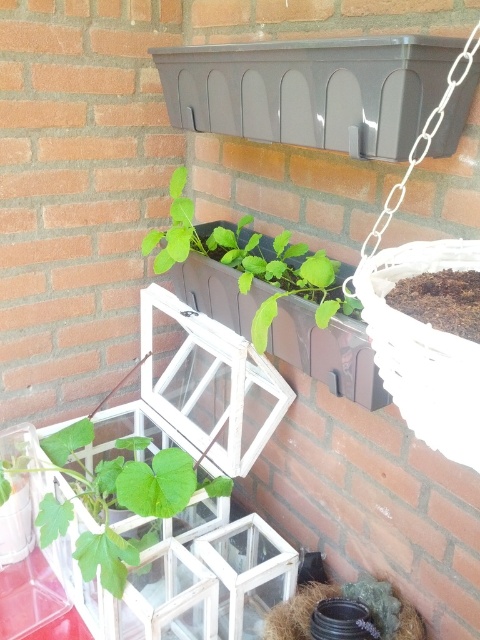
Question: Does green matte leafy plant at center have a lesser width compared to green matte plant at center?

Choices:
 (A) yes
 (B) no

Answer: (B)

Question: Which point is closer to the camera?

Choices:
 (A) (170, 182)
 (B) (93, 474)

Answer: (B)

Question: Is green matte leafy plant at center below green matte plant at center?

Choices:
 (A) yes
 (B) no

Answer: (A)

Question: Which object appears closest to the camera in this image?

Choices:
 (A) green matte plant at center
 (B) green matte leafy plant at center

Answer: (A)

Question: In this image, where is green matte leafy plant at center located relative to green matte plant at center?

Choices:
 (A) below
 (B) above

Answer: (A)